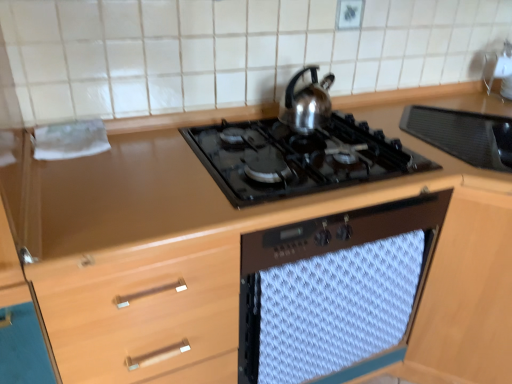
This screenshot has width=512, height=384. What are the coordinates of `vacant space to the right of satin silver kettle at upper center` in the screenshot? It's located at click(x=366, y=134).